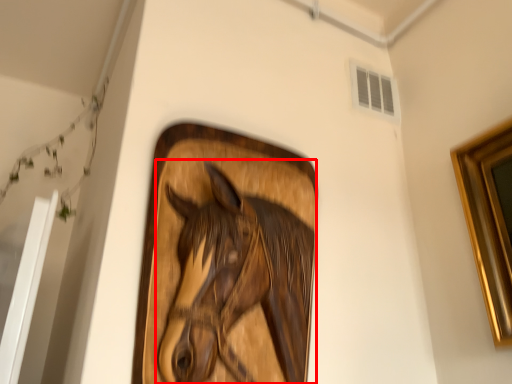
Question: Observing the image, what is the correct spatial positioning of horse (annotated by the red box) in reference to window?

Choices:
 (A) right
 (B) left

Answer: (B)